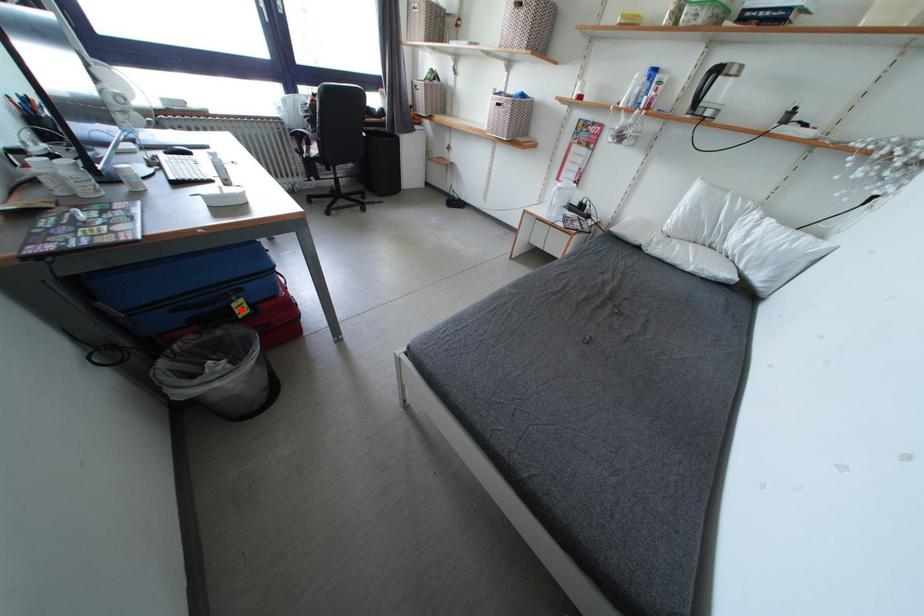
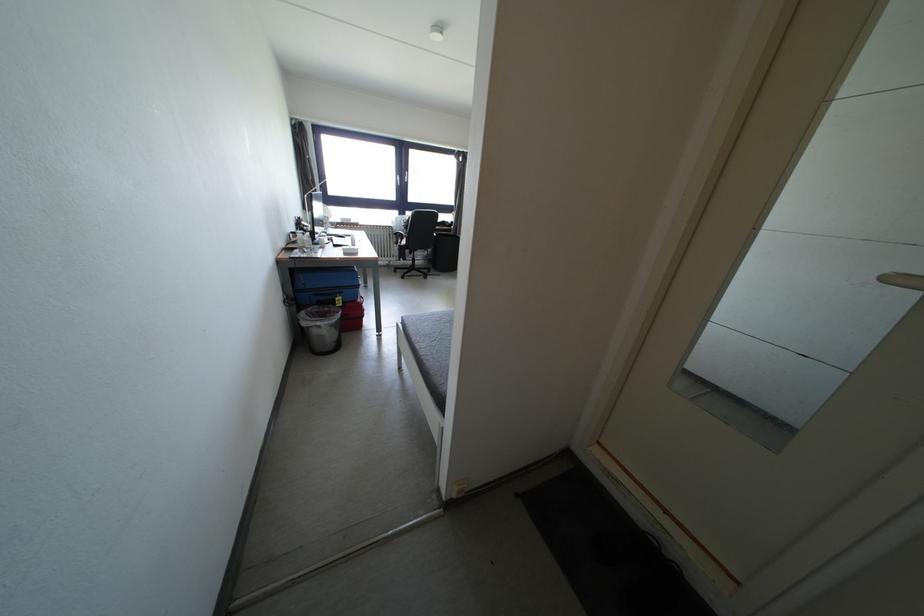
Question: I am providing you with two images of the same scene from different viewpoints. Image1 has a red point marked. In image2, the corresponding 3D location appears at what relative position? Reply with the corresponding letter.

Choices:
 (A) Closer
 (B) Farther

Answer: (A)